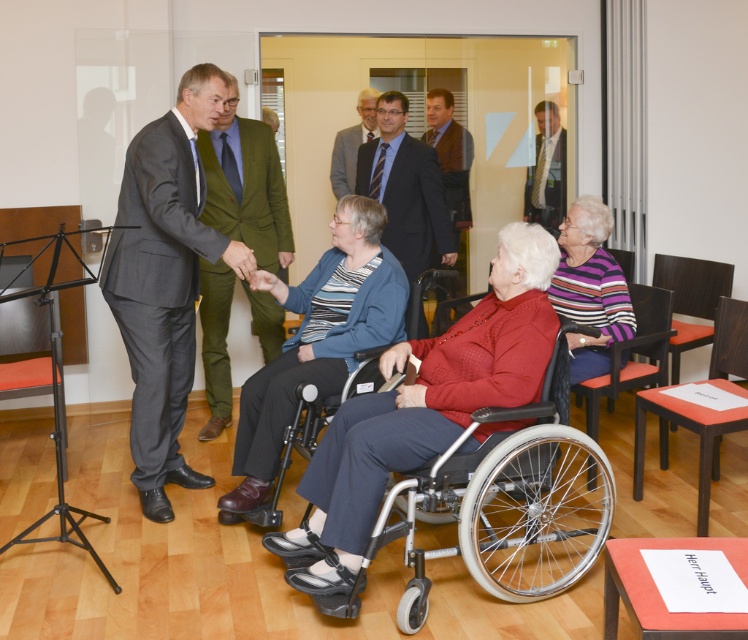
Question: Which object is positioned farthest from the brown leather jacket at center?

Choices:
 (A) metallic silver wheelchair at center
 (B) brown textured suit at center
 (C) green wool suit at center

Answer: (C)

Question: Is orange wood chair at right thinner than wooden chair at right?

Choices:
 (A) no
 (B) yes

Answer: (A)

Question: Which point is farther from the camera taking this photo?

Choices:
 (A) (429, 189)
 (B) (619, 259)
 (C) (272, 154)
 (D) (364, 109)

Answer: (D)

Question: Which point is farther to the camera?

Choices:
 (A) blue striped tie at center
 (B) wooden chair at right
 (C) orange wood chair at right
 (D) orange fabric chair at right

Answer: (A)

Question: Is metallic silver wheelchair at center positioned in front of wooden chair at right?

Choices:
 (A) yes
 (B) no

Answer: (A)

Question: From the image, what is the correct spatial relationship of silver metallic wheelchair at center in relation to orange fabric chair at right?

Choices:
 (A) right
 (B) left

Answer: (B)